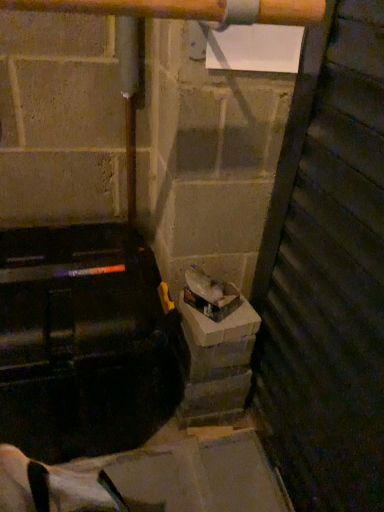
This screenshot has width=384, height=512. Identify the location of concreteroughconcrete block at center. (216, 362).

This screenshot has width=384, height=512. Describe the element at coordinates (216, 362) in the screenshot. I see `concreteroughconcrete block at center` at that location.

Measure the distance between point (299, 170) and camera.

A distance of 38.39 inches exists between point (299, 170) and camera.

Where is `shiny plastic bag at center`? shiny plastic bag at center is located at coordinates (210, 294).

Where is `concreteroughconcrete block at center`? concreteroughconcrete block at center is located at coordinates (216, 362).

Considering the sizes of objects concreteroughconcrete block at center and shiny plastic bag at center in the image provided, who is shorter, concreteroughconcrete block at center or shiny plastic bag at center?

With less height is shiny plastic bag at center.

Is concreteroughconcrete block at center to the left or to the right of shiny plastic bag at center in the image?

concreteroughconcrete block at center is positioned on shiny plastic bag at center's left side.

Relative to shiny plastic bag at center, is concreteroughconcrete block at center in front or behind?

concreteroughconcrete block at center is positioned farther from the viewer than shiny plastic bag at center.

From the image's perspective, is shiny plastic bag at center below wooden door at right?

Incorrect, from the image's perspective, shiny plastic bag at center is higher than wooden door at right.

Can wooden door at right be found inside shiny plastic bag at center?

No, wooden door at right is located outside of shiny plastic bag at center.

From the picture: Could you tell me if shiny plastic bag at center is facing wooden door at right?

No, shiny plastic bag at center is not turned towards wooden door at right.

From the image's perspective, who appears lower, concreteroughconcrete block at center or wooden door at right?

concreteroughconcrete block at center.

Is wooden door at right completely or partially inside concreteroughconcrete block at center?

No, wooden door at right is not a part of concreteroughconcrete block at center.

Considering the relative sizes of concreteroughconcrete block at center and wooden door at right in the image provided, is concreteroughconcrete block at center smaller than wooden door at right?

Indeed, concreteroughconcrete block at center has a smaller size compared to wooden door at right.

Could you tell me if concreteroughconcrete block at center is facing wooden door at right?

No.

Is wooden door at right in front of or behind shiny plastic bag at center in the image?

wooden door at right is in front of shiny plastic bag at center.

Who is shorter, wooden door at right or shiny plastic bag at center?

shiny plastic bag at center is shorter.

How many degrees apart are the facing directions of wooden door at right and shiny plastic bag at center?

37.6 degrees separate the facing orientations of wooden door at right and shiny plastic bag at center.

Is wooden door at right facing away from shiny plastic bag at center?

Absolutely, wooden door at right is directed away from shiny plastic bag at center.

From a real-world perspective, is shiny plastic bag at center below concreteroughconcrete block at center?

No, from a real-world perspective, shiny plastic bag at center is not beneath concreteroughconcrete block at center.

Which is behind, shiny plastic bag at center or concreteroughconcrete block at center?

concreteroughconcrete block at center is further away from the camera.

Could you tell me if shiny plastic bag at center is facing concreteroughconcrete block at center?

No, shiny plastic bag at center is not oriented towards concreteroughconcrete block at center.

Can you tell me how much shiny plastic bag at center and concreteroughconcrete block at center differ in facing direction?

52.5 degrees separate the facing orientations of shiny plastic bag at center and concreteroughconcrete block at center.

Considering the sizes of wooden door at right and concreteroughconcrete block at center in the image, is wooden door at right wider or thinner than concreteroughconcrete block at center?

Clearly, wooden door at right has less width compared to concreteroughconcrete block at center.

Would you say wooden door at right is a long distance from concreteroughconcrete block at center?

No, wooden door at right is not far from concreteroughconcrete block at center.

How different are the orientations of wooden door at right and concreteroughconcrete block at center in degrees?

The angular difference between wooden door at right and concreteroughconcrete block at center is 90.1 degrees.

From the image's perspective, who appears lower, wooden door at right or concreteroughconcrete block at center?

concreteroughconcrete block at center is shown below in the image.

In order to click on garbage lying above the concreteroughconcrete block at center (from the image's perspective) in this screenshot , I will do `click(210, 294)`.

Find the location of a particular element. The height and width of the screenshot is (512, 384). garbage behind the wooden door at right is located at coordinates (210, 294).

Looking at this image, from the image, which object appears to be nearer to shiny plastic bag at center, wooden door at right or concreteroughconcrete block at center?

concreteroughconcrete block at center is closer to shiny plastic bag at center.

Based on their spatial positions, is concreteroughconcrete block at center or shiny plastic bag at center further from wooden door at right?

shiny plastic bag at center is further to wooden door at right.

Based on their spatial positions, is shiny plastic bag at center or concreteroughconcrete block at center further from wooden door at right?

The object further to wooden door at right is shiny plastic bag at center.

Consider the image. When comparing their distances from shiny plastic bag at center, does concreteroughconcrete block at center or wooden door at right seem further?

Among the two, wooden door at right is located further to shiny plastic bag at center.

Based on their spatial positions, is wooden door at right or shiny plastic bag at center further from concreteroughconcrete block at center?

Among the two, wooden door at right is located further to concreteroughconcrete block at center.

Estimate the real-world distances between objects in this image. Which object is closer to concreteroughconcrete block at center, shiny plastic bag at center or wooden door at right?

shiny plastic bag at center.

Identify the location of garbage between wooden door at right and concreteroughconcrete block at center in the front-back direction. (210, 294).